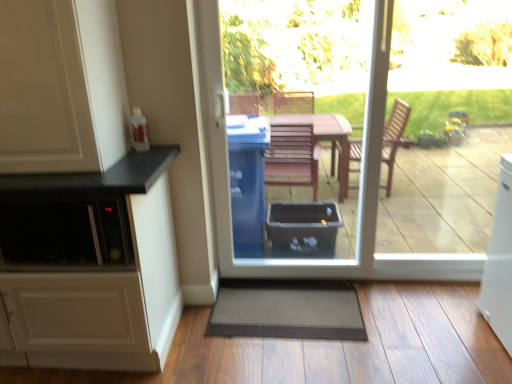
Question: Which is correct: transparent plastic bin at center is inside white matte cabinet at left, the 1th cabinetry positioned from the top, or outside of it?

Choices:
 (A) outside
 (B) inside

Answer: (A)

Question: In the image, is transparent plastic bin at center on the left side or the right side of white matte cabinet at left, the 1th cabinetry positioned from the top?

Choices:
 (A) right
 (B) left

Answer: (A)

Question: Which of these objects is positioned closest to the white matte cabinet at left, marked as the second cabinetry in a bottom-to-top arrangement?

Choices:
 (A) gray textured mat at lower center
 (B) white matte cabinet at left, which appears as the 2th cabinetry when viewed from the top
 (C) transparent plastic bin at center

Answer: (B)

Question: Considering the real-world distances, which object is closest to the transparent plastic bin at center?

Choices:
 (A) white matte cabinet at left, the 1th cabinetry positioned from the top
 (B) gray textured mat at lower center
 (C) white matte cabinet at left, which appears as the 2th cabinetry when viewed from the top

Answer: (B)